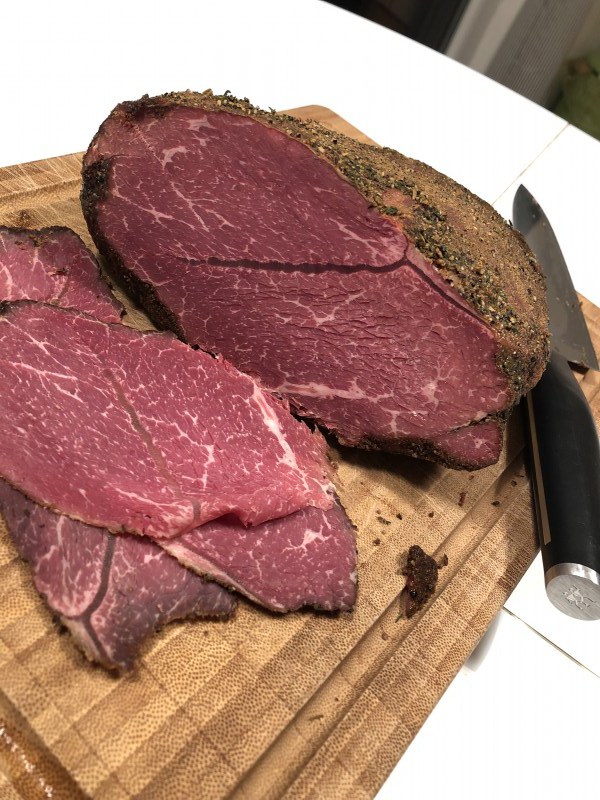
This screenshot has width=600, height=800. Find the location of `cutting board`. cutting board is located at coordinates (306, 238), (366, 448), (104, 250).